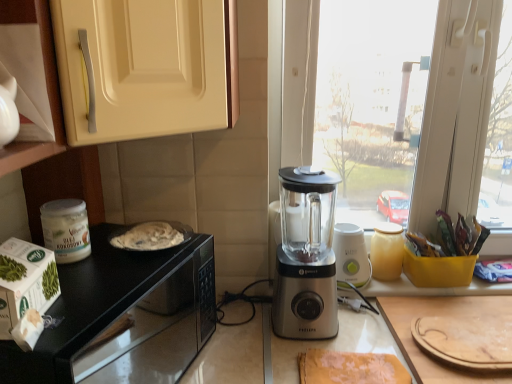
This screenshot has width=512, height=384. I want to click on satin silver blender at center, which is the 1th blender from right to left, so click(x=351, y=256).

The height and width of the screenshot is (384, 512). Describe the element at coordinates (66, 229) in the screenshot. I see `white glossy jar at left` at that location.

At what (x,y) coordinates should I click in order to perform the action: click on white matte cabinet at upper left, which is counted as the first cabinetry, starting from the front. Please return your answer as a coordinate pair (x, y). The image size is (512, 384). Looking at the image, I should click on (49, 102).

The height and width of the screenshot is (384, 512). I want to click on black glossy microwave at lower left, so click(x=122, y=314).

Does white cardboard box at left come in front of black glossy microwave at lower left?

Yes, it is in front of black glossy microwave at lower left.

Is white cardboard box at left situated inside black glossy microwave at lower left or outside?

white cardboard box at left cannot be found inside black glossy microwave at lower left.

Could you tell me if white cardboard box at left is turned towards black glossy microwave at lower left?

No, white cardboard box at left is not oriented towards black glossy microwave at lower left.

Consider the image. Are white cardboard box at left and black glossy microwave at lower left located far from each other?

white cardboard box at left is actually quite close to black glossy microwave at lower left.

Where is `cabinetry located behind the white matte cabinet at upper left, which is the second cabinetry from right to left`? cabinetry located behind the white matte cabinet at upper left, which is the second cabinetry from right to left is located at coordinates (145, 67).

What's the angular difference between matte cream cabinet at upper left, marked as the second cabinetry in a front-to-back arrangement, and white matte cabinet at upper left, the 1th cabinetry in the left-to-right sequence,'s facing directions?

There is a 3.06-degree angle between the facing directions of matte cream cabinet at upper left, marked as the second cabinetry in a front-to-back arrangement, and white matte cabinet at upper left, the 1th cabinetry in the left-to-right sequence.

From the image's perspective, is matte cream cabinet at upper left, arranged as the first cabinetry when viewed from the back, beneath white matte cabinet at upper left, which is counted as the first cabinetry, starting from the front?

Actually, matte cream cabinet at upper left, arranged as the first cabinetry when viewed from the back, appears above white matte cabinet at upper left, which is counted as the first cabinetry, starting from the front, in the image.

Is matte cream cabinet at upper left, arranged as the first cabinetry when viewed from the back, aimed at white matte cabinet at upper left, which is counted as the first cabinetry, starting from the front?

No, matte cream cabinet at upper left, arranged as the first cabinetry when viewed from the back, does not turn towards white matte cabinet at upper left, which is counted as the first cabinetry, starting from the front.

Measure the distance between yellow fabric at lower center and black glossy microwave at lower left.

A distance of 15.97 inches exists between yellow fabric at lower center and black glossy microwave at lower left.

Which of these two, yellow fabric at lower center or black glossy microwave at lower left, stands taller?

black glossy microwave at lower left.

Where is `countertop above the yellow fabric at lower center (from the image's perspective)`? Image resolution: width=512 pixels, height=384 pixels. countertop above the yellow fabric at lower center (from the image's perspective) is located at coordinates (122, 314).

Between satin silver blender at center, placed as the second blender when sorted from front to back, and yellow fabric at lower center, which one has less height?

yellow fabric at lower center.

From the picture: Considering the positions of objects satin silver blender at center, marked as the first blender in a back-to-front arrangement, and yellow fabric at lower center in the image provided, who is behind, satin silver blender at center, marked as the first blender in a back-to-front arrangement, or yellow fabric at lower center?

Positioned behind is satin silver blender at center, marked as the first blender in a back-to-front arrangement.

Considering the positions of point (357, 282) and point (308, 357), is point (357, 282) closer or farther from the camera than point (308, 357)?

Point (357, 282) is positioned farther from the camera compared to point (308, 357).

Is satin silver blender at center, acting as the second blender starting from the back, facing away from matte cream cabinet at upper left, arranged as the first cabinetry when viewed from the back?

No, satin silver blender at center, acting as the second blender starting from the back, is not facing away from matte cream cabinet at upper left, arranged as the first cabinetry when viewed from the back.

Does satin silver blender at center, which is the 1th blender from front to back, have a greater width compared to matte cream cabinet at upper left, which is the 1th cabinetry in right-to-left order?

Incorrect, the width of satin silver blender at center, which is the 1th blender from front to back, does not surpass that of matte cream cabinet at upper left, which is the 1th cabinetry in right-to-left order.

From the image's perspective, is satin silver blender at center, acting as the second blender starting from the back, on top of matte cream cabinet at upper left, which is the 1th cabinetry in right-to-left order?

No, from the image's perspective, satin silver blender at center, acting as the second blender starting from the back, is not on top of matte cream cabinet at upper left, which is the 1th cabinetry in right-to-left order.

In the image, is satin silver blender at center, the second blender viewed from the right, on the left side or the right side of matte cream cabinet at upper left, which is the 1th cabinetry in right-to-left order?

In the image, satin silver blender at center, the second blender viewed from the right, appears on the right side of matte cream cabinet at upper left, which is the 1th cabinetry in right-to-left order.

Does matte cream cabinet at upper left, marked as the second cabinetry in a front-to-back arrangement, have a greater width compared to white cardboard box at left?

Yes.

From the picture: How many degrees apart are the facing directions of matte cream cabinet at upper left, which is the 1th cabinetry in right-to-left order, and white cardboard box at left?

7.06 degrees.

From the image's perspective, is matte cream cabinet at upper left, which is the 1th cabinetry in right-to-left order, located beneath white cardboard box at left?

No.

Find the location of a particular element. The width and height of the screenshot is (512, 384). the 1st cabinetry above when counting from the black glossy microwave at lower left (from the image's perspective) is located at coordinates (49, 102).

Is black glossy microwave at lower left in front of white matte cabinet at upper left, marked as the 2th cabinetry in a back-to-front arrangement?

No, it is behind white matte cabinet at upper left, marked as the 2th cabinetry in a back-to-front arrangement.

In the image, is black glossy microwave at lower left on the left side or the right side of white matte cabinet at upper left, which is the second cabinetry from right to left?

black glossy microwave at lower left is to the left of white matte cabinet at upper left, which is the second cabinetry from right to left.

Measure the distance between black glossy microwave at lower left and white matte cabinet at upper left, the 1th cabinetry in the left-to-right sequence.

The distance of black glossy microwave at lower left from white matte cabinet at upper left, the 1th cabinetry in the left-to-right sequence, is 47.57 centimeters.

At what (x,y) coordinates should I click in order to perform the action: click on home appliance above the black glossy microwave at lower left (from a real-world perspective). Please return your answer as a coordinate pair (x, y). This screenshot has height=384, width=512. Looking at the image, I should click on (25, 282).

You are a GUI agent. You are given a task and a screenshot of the screen. Output one action in this format:
    pyautogui.click(x=<x>, y=<y>)
    Task: Click on the cabinetry located below the matte cream cabinet at upper left, positioned as the 2th cabinetry in left-to-right order (from the image's perspective)
    
    Given the screenshot: What is the action you would take?
    pyautogui.click(x=49, y=102)

Looking at this image, from the image, which object appears to be nearer to satin silver blender at center, which is the 1th blender from front to back, black glossy microwave at lower left or matte cream cabinet at upper left, which is the 1th cabinetry in right-to-left order?

black glossy microwave at lower left is positioned closer to the anchor satin silver blender at center, which is the 1th blender from front to back.

From the image, which object appears to be farther from satin silver blender at center, acting as the second blender starting from the back, yellow fabric at lower center or black glossy microwave at lower left?

black glossy microwave at lower left lies further to satin silver blender at center, acting as the second blender starting from the back, than the other object.

Looking at the image, which one is located closer to satin silver blender at center, placed as the second blender when sorted from front to back, satin silver blender at center, acting as the second blender starting from the back, or white glossy jar at left?

satin silver blender at center, acting as the second blender starting from the back, lies closer to satin silver blender at center, placed as the second blender when sorted from front to back, than the other object.

Looking at the image, which one is located closer to black glossy microwave at lower left, matte cream cabinet at upper left, arranged as the first cabinetry when viewed from the back, or white cardboard box at left?

white cardboard box at left is closer to black glossy microwave at lower left.

From the image, which object appears to be nearer to black glossy microwave at lower left, white cardboard box at left or satin silver blender at center, which is the 1th blender from right to left?

white cardboard box at left is closer to black glossy microwave at lower left.

When comparing their distances from white cardboard box at left, does yellow fabric at lower center or black glossy microwave at lower left seem further?

yellow fabric at lower center.

Which object lies nearer to the anchor point black glossy microwave at lower left, yellow fabric at lower center or white cardboard box at left?

white cardboard box at left.

Considering their positions, is matte cream cabinet at upper left, marked as the second cabinetry in a front-to-back arrangement, positioned closer to satin silver blender at center, which is the 1th blender from front to back, than black glossy microwave at lower left?

black glossy microwave at lower left is closer to satin silver blender at center, which is the 1th blender from front to back.

Where is `countertop between matte cream cabinet at upper left, positioned as the 2th cabinetry in left-to-right order, and yellow fabric at lower center from top to bottom`? countertop between matte cream cabinet at upper left, positioned as the 2th cabinetry in left-to-right order, and yellow fabric at lower center from top to bottom is located at coordinates (122, 314).

At what (x,y) coordinates should I click in order to perform the action: click on blender between white glossy jar at left and satin silver blender at center, marked as the first blender in a back-to-front arrangement. Please return your answer as a coordinate pair (x, y). The width and height of the screenshot is (512, 384). Looking at the image, I should click on (306, 256).

Locate an element on the screen. home appliance between matte cream cabinet at upper left, positioned as the 2th cabinetry in left-to-right order, and yellow fabric at lower center in the up-down direction is located at coordinates (25, 282).

The height and width of the screenshot is (384, 512). Find the location of `blender situated between white matte cabinet at upper left, the 1th cabinetry in the left-to-right sequence, and yellow fabric at lower center from left to right`. blender situated between white matte cabinet at upper left, the 1th cabinetry in the left-to-right sequence, and yellow fabric at lower center from left to right is located at coordinates (306, 256).